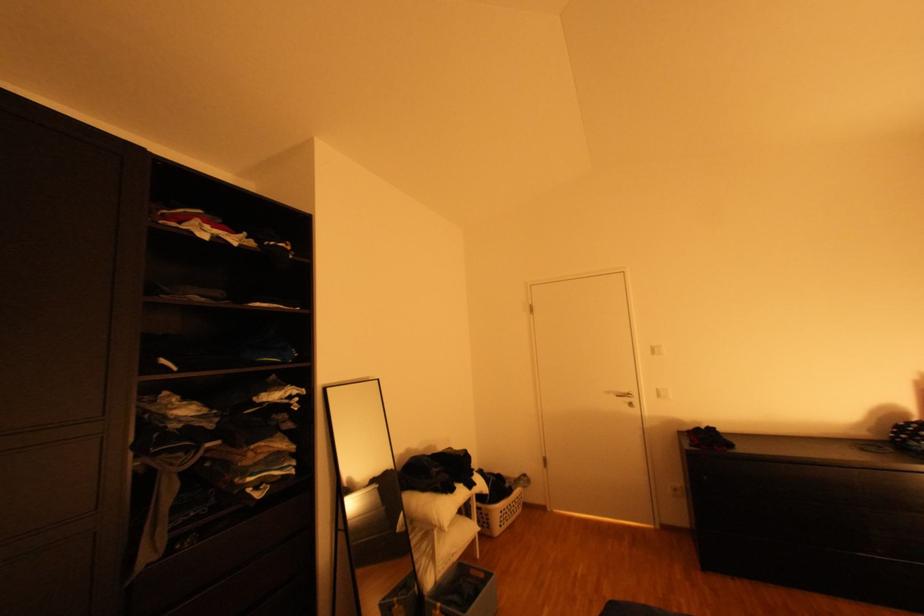
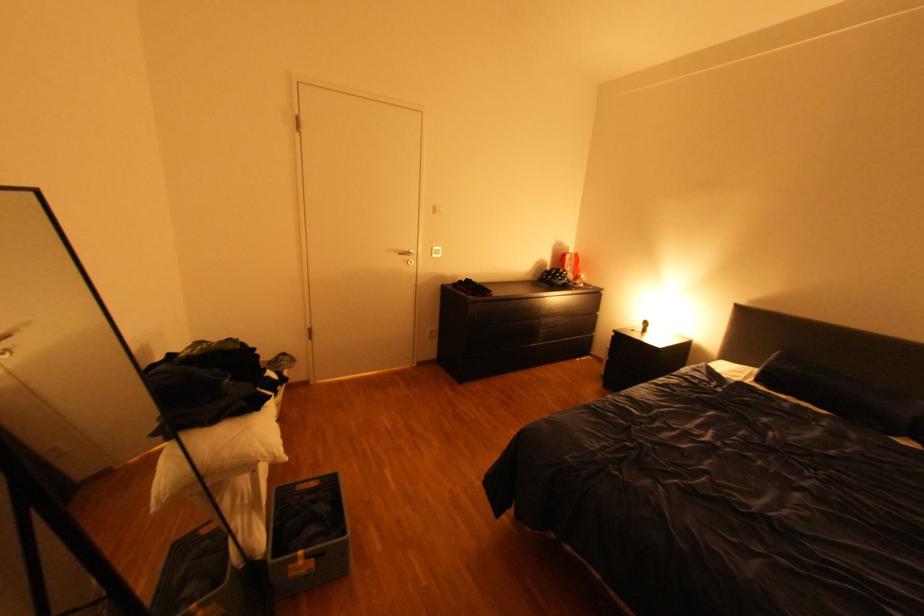
Where in the second image is the point corresponding to [482,572] from the first image?

(310, 488)